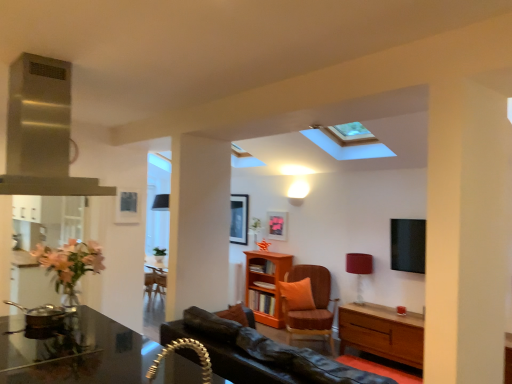
Question: Would you say stainless steel exhaust hood at upper left is outside shiny black desk at lower left?

Choices:
 (A) no
 (B) yes

Answer: (B)

Question: Considering the relative sizes of stainless steel exhaust hood at upper left and shiny black desk at lower left in the image provided, is stainless steel exhaust hood at upper left taller than shiny black desk at lower left?

Choices:
 (A) no
 (B) yes

Answer: (B)

Question: Considering the relative positions of stainless steel exhaust hood at upper left and shiny black desk at lower left in the image provided, is stainless steel exhaust hood at upper left to the left of shiny black desk at lower left from the viewer's perspective?

Choices:
 (A) yes
 (B) no

Answer: (A)

Question: Considering the relative sizes of stainless steel exhaust hood at upper left and shiny black desk at lower left in the image provided, is stainless steel exhaust hood at upper left smaller than shiny black desk at lower left?

Choices:
 (A) yes
 (B) no

Answer: (A)

Question: From a real-world perspective, is stainless steel exhaust hood at upper left under shiny black desk at lower left?

Choices:
 (A) no
 (B) yes

Answer: (A)

Question: Is stainless steel exhaust hood at upper left at the right side of shiny black desk at lower left?

Choices:
 (A) yes
 (B) no

Answer: (B)

Question: Is matte red lampshade at right touching shiny black desk at lower left?

Choices:
 (A) yes
 (B) no

Answer: (B)

Question: Considering the relative sizes of matte red lampshade at right and shiny black desk at lower left in the image provided, is matte red lampshade at right wider than shiny black desk at lower left?

Choices:
 (A) yes
 (B) no

Answer: (B)

Question: Would you consider matte red lampshade at right to be distant from shiny black desk at lower left?

Choices:
 (A) no
 (B) yes

Answer: (B)

Question: Is matte red lampshade at right at the left side of shiny black desk at lower left?

Choices:
 (A) yes
 (B) no

Answer: (B)

Question: Can you confirm if matte red lampshade at right is thinner than shiny black desk at lower left?

Choices:
 (A) no
 (B) yes

Answer: (B)

Question: Is matte red lampshade at right shorter than shiny black desk at lower left?

Choices:
 (A) no
 (B) yes

Answer: (B)

Question: Is matte pink picture frame at center completely or partially inside stainless steel exhaust hood at upper left?

Choices:
 (A) no
 (B) yes

Answer: (A)